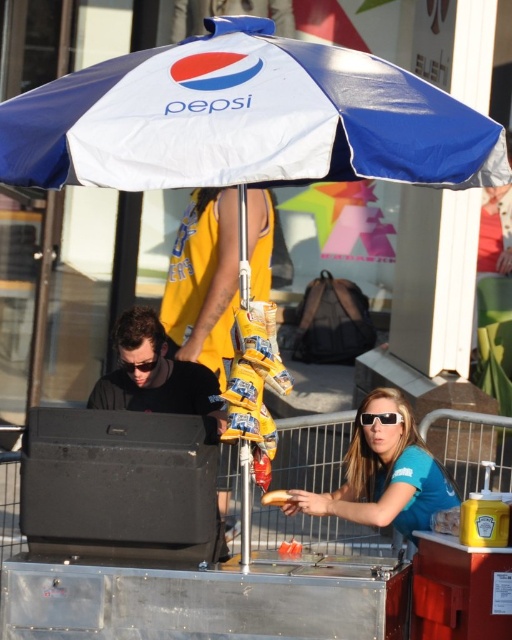
Question: Does blue fabric sunglasses at center appear on the right side of black matte speaker at lower left?

Choices:
 (A) yes
 (B) no

Answer: (A)

Question: Does black matte speaker at lower left appear on the left side of golden crispy french fry at center?

Choices:
 (A) no
 (B) yes

Answer: (B)

Question: Which of the following is the farthest from the observer?

Choices:
 (A) clear plastic sunglasses at lower center
 (B) golden crispy french fry at center

Answer: (A)

Question: Can you confirm if black matte speaker at lower left is bigger than golden crispy french fry at center?

Choices:
 (A) yes
 (B) no

Answer: (A)

Question: Based on their relative distances, which object is farther from the clear plastic sunglasses at lower center?

Choices:
 (A) blue fabric sunglasses at center
 (B) black matte speaker at lower left
 (C) golden crispy french fry at center

Answer: (B)

Question: Which point is farther from the camera taking this photo?

Choices:
 (A) (278, 500)
 (B) (181, 403)

Answer: (B)